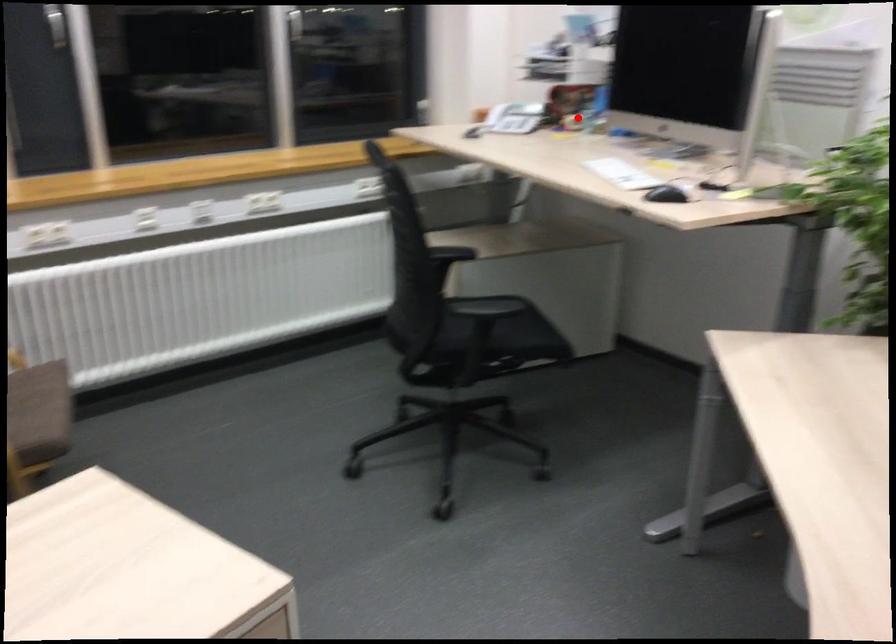
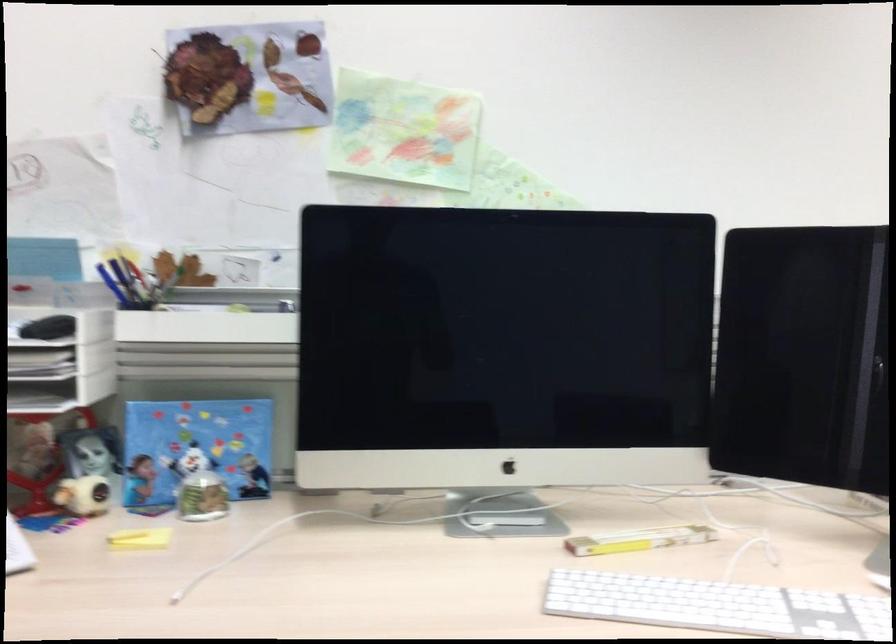
Where in the second image is the point corresponding to the highlighted location from the first image?

(83, 495)